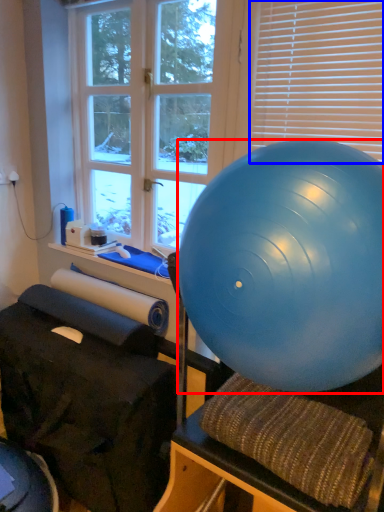
Question: Which of the following is the farthest to the observer, ball (highlighted by a red box) or blind (highlighted by a blue box)?

Choices:
 (A) ball
 (B) blind

Answer: (B)